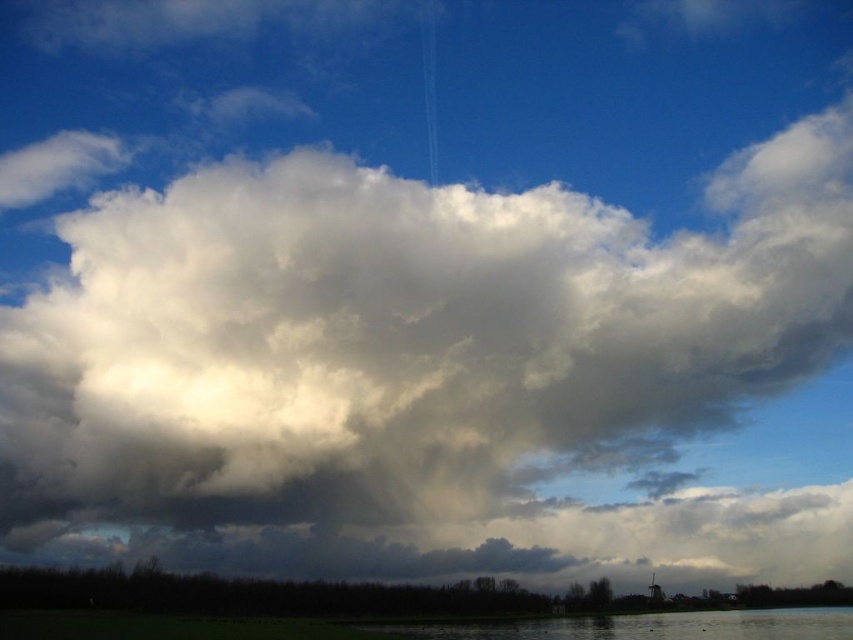
Question: Is white fluffy cloud at center to the right of smooth water at lower center from the viewer's perspective?

Choices:
 (A) yes
 (B) no

Answer: (B)

Question: Which point is farther to the camera?

Choices:
 (A) smooth water at lower center
 (B) white fluffy cloud at center

Answer: (B)

Question: Does white fluffy cloud at center appear over smooth water at lower center?

Choices:
 (A) no
 (B) yes

Answer: (B)

Question: Is white fluffy cloud at center positioned at the back of smooth water at lower center?

Choices:
 (A) no
 (B) yes

Answer: (B)

Question: Among these points, which one is nearest to the camera?

Choices:
 (A) (143, 269)
 (B) (625, 636)

Answer: (B)

Question: Which object is closer to the camera taking this photo?

Choices:
 (A) white fluffy cloud at center
 (B) smooth water at lower center

Answer: (B)